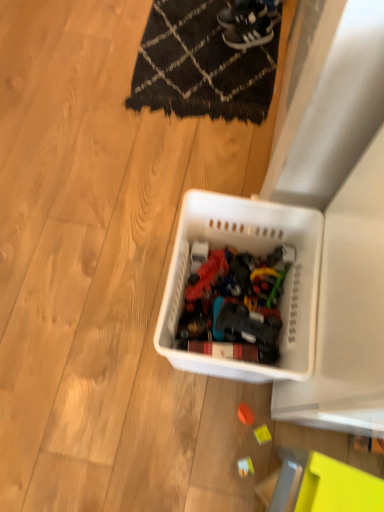
You are a GUI agent. You are given a task and a screenshot of the screen. Output one action in this format:
    pyautogui.click(x=<x>, y=<y>)
    Task: Click on the vacant area that lies to the right of black suede sneakers at upper center, placed as the second footwear when sorted from bottom to top
    The height and width of the screenshot is (512, 384).
    Given the screenshot: What is the action you would take?
    pyautogui.click(x=266, y=27)